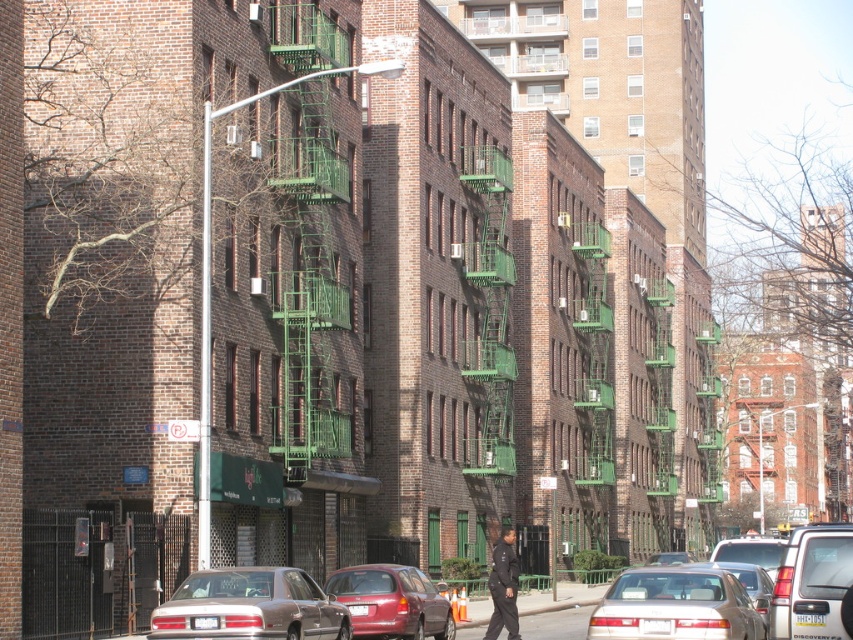
Question: Does green metal fire escape at center appear under silver metallic suv at center right?

Choices:
 (A) no
 (B) yes

Answer: (A)

Question: Based on their relative distances, which object is farther from the dark blue uniform at center?

Choices:
 (A) gold metallic sedan at center
 (B) metallic silver sedan at lower center
 (C) silver metallic suv at center right

Answer: (C)

Question: Where is green matte fire escape at center located in relation to dark blue uniform at center in the image?

Choices:
 (A) above
 (B) below

Answer: (A)

Question: Which point is closer to the camera taking this photo?

Choices:
 (A) (500, 458)
 (B) (755, 621)
 (C) (490, 582)
 (D) (323, 109)

Answer: (B)

Question: Does metallic red station wagon at center have a lesser width compared to dark blue uniform at center?

Choices:
 (A) yes
 (B) no

Answer: (A)

Question: Estimate the real-world distances between objects in this image. Which object is farther from the green matte fire escape at center?

Choices:
 (A) green metal fire escape at center
 (B) silver metallic suv at center right
 (C) metallic silver sedan at lower center

Answer: (B)